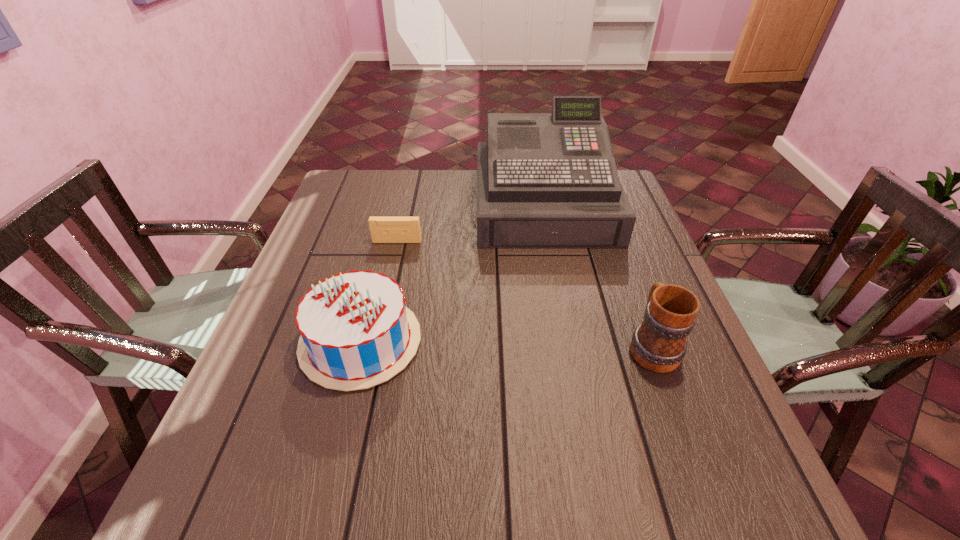
I want to click on cash register, so click(x=544, y=180).

The height and width of the screenshot is (540, 960). Identify the location of mug. (658, 344).

Identify the location of birthday cake. (356, 332).

Where is `videotape`? videotape is located at coordinates (383, 229).

Image resolution: width=960 pixels, height=540 pixels. I want to click on free space located on the front-facing side of the cash register, so click(575, 363).

Find the location of a particular element. The image size is (960, 540). vacant region located on the side of the mug with the handle is located at coordinates pos(612,237).

The image size is (960, 540). I want to click on vacant space situated 0.180m on the side of the mug with the handle, so click(x=623, y=267).

The height and width of the screenshot is (540, 960). I want to click on vacant space located 0.310m on the side of the mug with the handle, so click(612, 237).

Image resolution: width=960 pixels, height=540 pixels. I want to click on free space located 0.210m on the front of the birthday cake, so click(318, 509).

Locate an element on the screen. This screenshot has width=960, height=540. vacant space located 0.100m at the front of the videotape with spools is located at coordinates (391, 268).